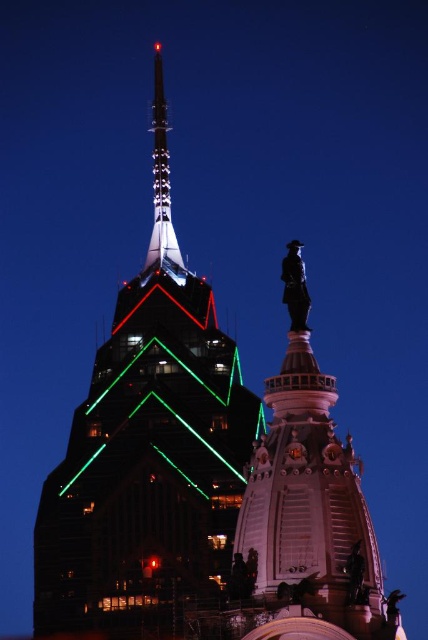
You are an architect evaluating the spatial requirements for a new sculpture garden. You observe the polished bronze statue at center and the shiny metallic spire at upper center in the image. Based on their sizes, which object would require a smaller area to display appropriately?

The polished bronze statue at center occupies less space than the shiny metallic spire at upper center, so it would require a smaller area to display appropriately.

You are a city planner assessing the width of two central structures in the image. The metallic glass skyscraper at center and the polished bronze statue at center. Which one is wider?

The metallic glass skyscraper at center is wider than the polished bronze statue at center according to the description.

You are a drone operator who needs to fly a drone through the space between the metallic glass skyscraper at center and the shiny metallic spire at upper center. The drone has a maximum height of 100 meters. Can the drone safely pass between them without hitting either structure?

The metallic glass skyscraper at center is larger in size than the shiny metallic spire at upper center. However, the question of whether the drone can pass safely depends on the vertical clearance between the top of the skyscraper and the bottom of the spire. Since the description only states the relative size and not the exact dimensions or distance between them, it is impossible to determine if the 100 meter height limit allows safe passage. More information about their vertical spacing is needed.